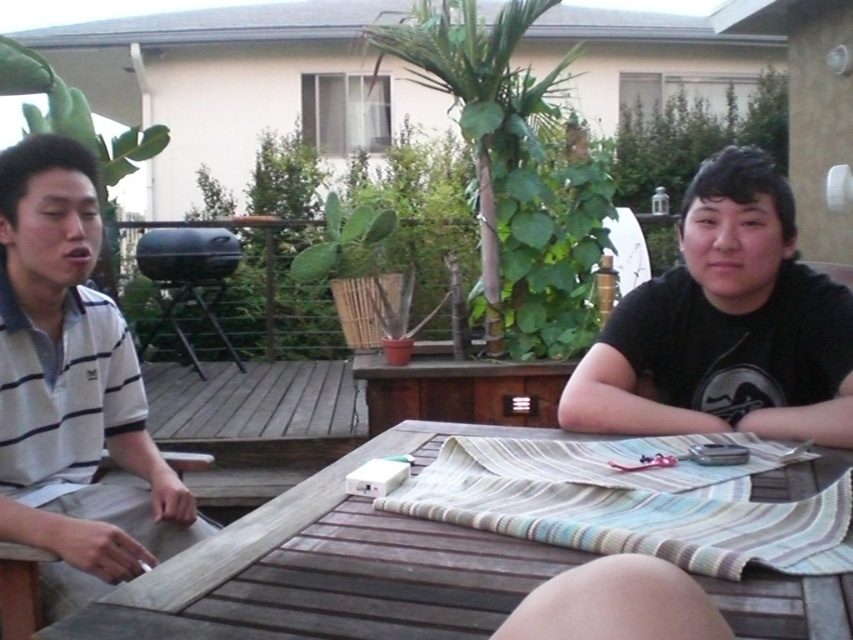
Question: Does wooden table at center appear over black matte shirt at right?

Choices:
 (A) yes
 (B) no

Answer: (B)

Question: Among these points, which one is farthest from the camera?

Choices:
 (A) (718, 205)
 (B) (99, 403)

Answer: (B)

Question: Which point is closer to the camera?

Choices:
 (A) (824, 470)
 (B) (732, 403)

Answer: (A)

Question: Does wooden table at center appear over white striped polo shirt at left?

Choices:
 (A) no
 (B) yes

Answer: (A)

Question: Is wooden table at center in front of white striped polo shirt at left?

Choices:
 (A) yes
 (B) no

Answer: (A)

Question: Estimate the real-world distances between objects in this image. Which object is farther from the wooden table at center?

Choices:
 (A) white striped polo shirt at left
 (B) black matte shirt at right

Answer: (A)